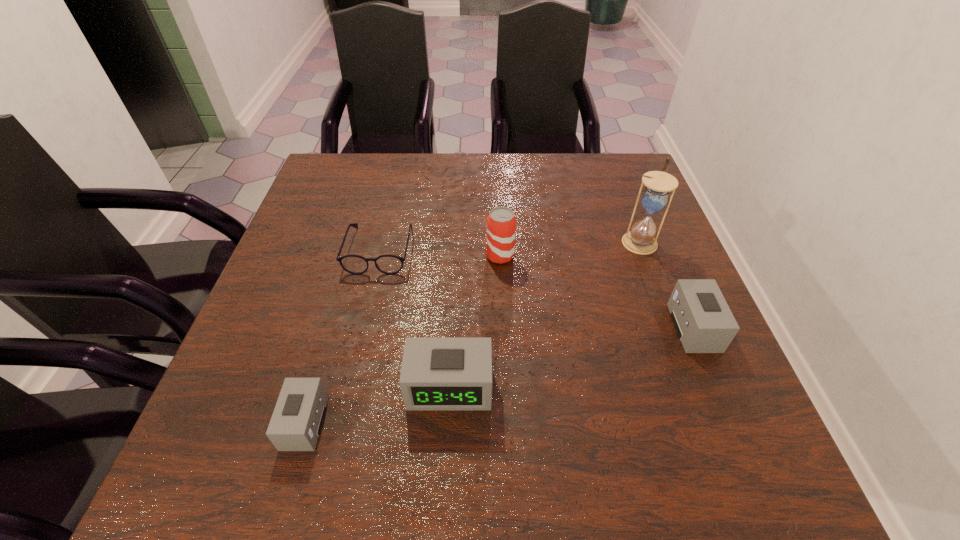
Where is `the shortest alarm clock`? the shortest alarm clock is located at coordinates (296, 422).

Image resolution: width=960 pixels, height=540 pixels. Identify the location of the tallest alarm clock. (438, 373).

Identify the location of the third tallest object. (438, 373).

The width and height of the screenshot is (960, 540). I want to click on the rightmost alarm clock, so click(x=704, y=323).

This screenshot has width=960, height=540. Find the location of `the second tallest alarm clock`. the second tallest alarm clock is located at coordinates (704, 323).

Locate an element on the screen. spectacles is located at coordinates (388, 264).

This screenshot has height=540, width=960. I want to click on the tallest object, so coord(641,239).

The width and height of the screenshot is (960, 540). In order to click on beer can in this screenshot , I will do `click(501, 223)`.

This screenshot has height=540, width=960. In order to click on vacant space located 0.120m on the front-facing side of the shortest alarm clock in this screenshot , I will do `click(217, 422)`.

Image resolution: width=960 pixels, height=540 pixels. I want to click on vacant space situated on the front-facing side of the shortest alarm clock, so click(258, 422).